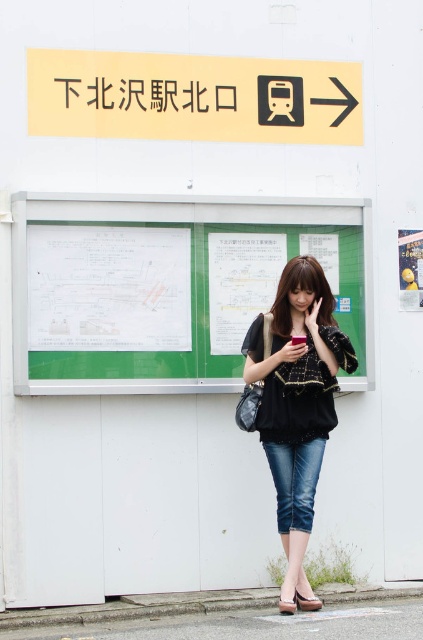
You are a traveler at the Shibuya Station North Exit. You see a woman wearing denim jeans at center and a white paper poster at right. Which object is bigger in size?

The denim jeans at center has a larger size compared to the white paper poster at right.

You are a traveler standing in front of the notice board at the train station. You notice the green matte bulletin board at center and the leather sandal at lower center. Which object is closer to you?

The green matte bulletin board at center is closer to you because it is further to the viewer than the leather sandal at lower center.

You are a traveler at the Shibuya Station North Exit. You notice a green paperboard poster at center and a leather sandal at lower center. Which object is taller?

The green paperboard poster at center is taller than the leather sandal at lower center.